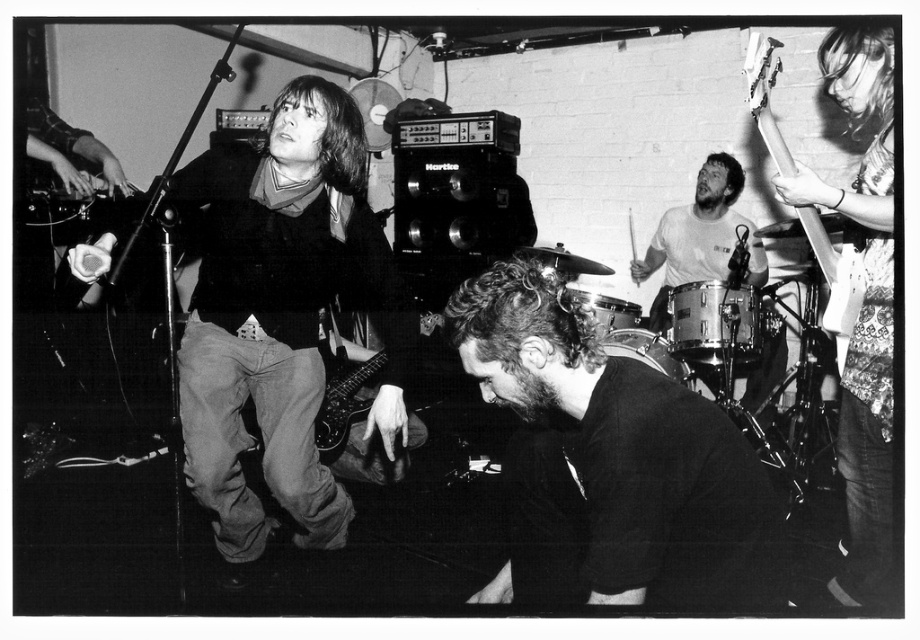
Question: Is the position of metallic silver guitar at upper right more distant than that of metallic dark guitar at lower center?

Choices:
 (A) no
 (B) yes

Answer: (A)

Question: Where is black matte shirt at center located in relation to metallic silver guitar at upper right in the image?

Choices:
 (A) below
 (B) above

Answer: (A)

Question: Which of the following is the closest to the observer?

Choices:
 (A) (765, 124)
 (B) (857, 54)
 (C) (342, 392)
 (D) (690, 602)

Answer: (D)

Question: Which point is closer to the camera?

Choices:
 (A) (857, 310)
 (B) (645, 518)
 (C) (328, 385)

Answer: (B)

Question: Is black matte shirt at center below metallic silver guitar at upper right?

Choices:
 (A) no
 (B) yes

Answer: (B)

Question: Among these points, which one is nearest to the camera?

Choices:
 (A) (524, 467)
 (B) (318, 445)

Answer: (A)